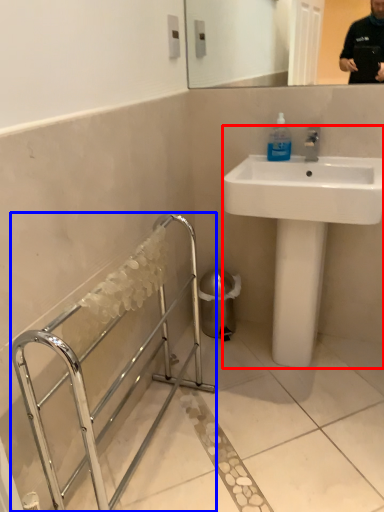
Question: Which of the following is the closest to the observer, sink (highlighted by a red box) or balustrade (highlighted by a blue box)?

Choices:
 (A) sink
 (B) balustrade

Answer: (B)